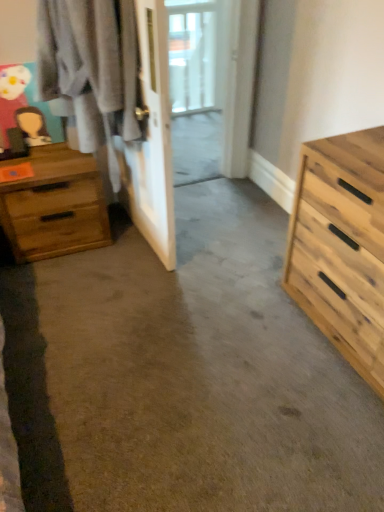
Question: Considering the relative positions of natural wood chest of drawers at right, the 1th chest of drawers when ordered from right to left, and wooden dresser at left in the image provided, is natural wood chest of drawers at right, the 1th chest of drawers when ordered from right to left, behind wooden dresser at left?

Choices:
 (A) yes
 (B) no

Answer: (B)

Question: From the image's perspective, is natural wood chest of drawers at right, marked as the first chest of drawers in a front-to-back arrangement, on top of wooden dresser at left?

Choices:
 (A) yes
 (B) no

Answer: (B)

Question: Is natural wood chest of drawers at right, marked as the first chest of drawers in a front-to-back arrangement, far away from wooden dresser at left?

Choices:
 (A) no
 (B) yes

Answer: (A)

Question: Can you confirm if natural wood chest of drawers at right, placed as the second chest of drawers when sorted from left to right, is taller than wooden dresser at left?

Choices:
 (A) no
 (B) yes

Answer: (A)

Question: Is natural wood chest of drawers at right, the 2th chest of drawers in the back-to-front sequence, aimed at wooden dresser at left?

Choices:
 (A) no
 (B) yes

Answer: (A)

Question: Considering the relative sizes of natural wood chest of drawers at right, marked as the first chest of drawers in a front-to-back arrangement, and wooden dresser at left in the image provided, is natural wood chest of drawers at right, marked as the first chest of drawers in a front-to-back arrangement, shorter than wooden dresser at left?

Choices:
 (A) no
 (B) yes

Answer: (B)

Question: Is wooden chest of drawers at left, which ranks as the 1th chest of drawers in back-to-front order, shorter than wooden dresser at left?

Choices:
 (A) no
 (B) yes

Answer: (B)

Question: Is wooden chest of drawers at left, which ranks as the 2th chest of drawers in front-to-back order, at the left side of wooden dresser at left?

Choices:
 (A) yes
 (B) no

Answer: (A)

Question: From a real-world perspective, is wooden chest of drawers at left, which ranks as the 1th chest of drawers in back-to-front order, under wooden dresser at left?

Choices:
 (A) yes
 (B) no

Answer: (A)

Question: Is wooden chest of drawers at left, which ranks as the 2th chest of drawers in front-to-back order, placed right next to wooden dresser at left?

Choices:
 (A) yes
 (B) no

Answer: (B)

Question: Is the position of wooden chest of drawers at left, which ranks as the 2th chest of drawers in front-to-back order, less distant than that of wooden dresser at left?

Choices:
 (A) yes
 (B) no

Answer: (B)

Question: Is wooden chest of drawers at left, which ranks as the 1th chest of drawers in back-to-front order, oriented towards wooden dresser at left?

Choices:
 (A) yes
 (B) no

Answer: (B)

Question: Can you confirm if wooden dresser at left is bigger than wooden chest of drawers at left, marked as the 1th chest of drawers in a left-to-right arrangement?

Choices:
 (A) yes
 (B) no

Answer: (A)